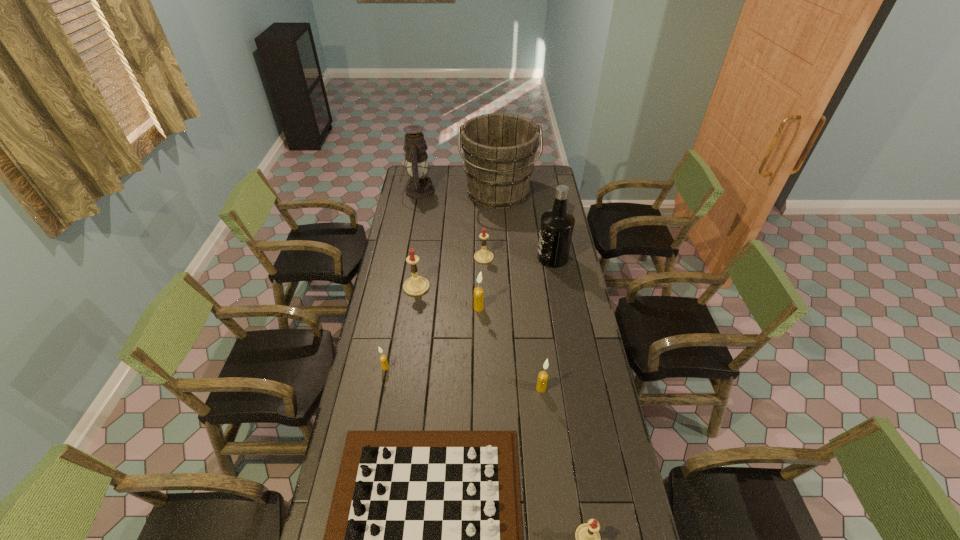
Locate which object is the second closest to the nearest red candle. Please provide its 2D coordinates. Your answer should be formatted as a tuple, i.e. [(x, y)], where the tuple contains the x and y coordinates of a point satisfying the conditions above.

[(543, 376)]

Point out which object is positioned as the third nearest to the eighth farthest object. Please provide its 2D coordinates. Your answer should be formatted as a tuple, i.e. [(x, y)], where the tuple contains the x and y coordinates of a point satisfying the conditions above.

[(587, 537)]

Choose which candle is the nearest neighbor to the bucket. Please provide its 2D coordinates. Your answer should be formatted as a tuple, i.e. [(x, y)], where the tuple contains the x and y coordinates of a point satisfying the conditions above.

[(483, 256)]

Locate which candle ranks third in proximity to the gameboard. Please provide its 2D coordinates. Your answer should be formatted as a tuple, i.e. [(x, y)], where the tuple contains the x and y coordinates of a point satisfying the conditions above.

[(383, 358)]

I want to click on cream candle identified as the third closest to the leftmost red candle, so click(x=543, y=376).

Identify which cream candle is the second nearest to the second farthest candle. Please provide its 2D coordinates. Your answer should be formatted as a tuple, i.e. [(x, y)], where the tuple contains the x and y coordinates of a point satisfying the conditions above.

[(383, 358)]

In order to click on the closest red candle to the fourth nearest object in this screenshot , I will do `click(416, 285)`.

What are the coordinates of `red candle identified as the closest to the gameboard` in the screenshot? It's located at coord(587,537).

This screenshot has width=960, height=540. I want to click on vacant space that satisfies the following two spatial constraints: 1. on the handle side of the nearest cream candle; 2. on the left side of the bucket, so click(x=509, y=388).